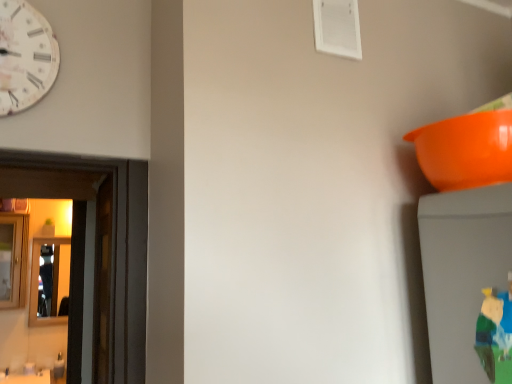
In order to face plush green toy at lower right, should I rotate leftwards or rightwards?

A 32.552 degree turn to the right will do.

The height and width of the screenshot is (384, 512). What are the coordinates of `plush green toy at lower right` in the screenshot? It's located at (496, 334).

I want to click on orange plastic bowl at upper right, so click(466, 150).

You are a GUI agent. You are given a task and a screenshot of the screen. Output one action in this format:
    pyautogui.click(x=<x>, y=<y>)
    Task: Click on the shiny silver mirror at left, which appears as the 2th mirror when viewed from the front
    This screenshot has height=384, width=512.
    Given the screenshot: What is the action you would take?
    pyautogui.click(x=38, y=282)

The width and height of the screenshot is (512, 384). In order to click on wooden mirror at left, which is the first mirror from front to back in this screenshot , I will do [x=13, y=260].

Locate an element on the screen. white paper-like clock at upper left is located at coordinates click(25, 56).

Would you say plush green toy at lower right is a long distance from shiny silver mirror at left, which appears as the 2th mirror when viewed from the front?

Yes, plush green toy at lower right is far from shiny silver mirror at left, which appears as the 2th mirror when viewed from the front.

Which is correct: plush green toy at lower right is inside shiny silver mirror at left, the first mirror positioned from the back, or outside of it?

plush green toy at lower right cannot be found inside shiny silver mirror at left, the first mirror positioned from the back.

Is plush green toy at lower right positioned with its back to shiny silver mirror at left, which appears as the 2th mirror when viewed from the front?

No, plush green toy at lower right is not facing away from shiny silver mirror at left, which appears as the 2th mirror when viewed from the front.

Considering the relative sizes of plush green toy at lower right and shiny silver mirror at left, the first mirror positioned from the back, in the image provided, is plush green toy at lower right wider than shiny silver mirror at left, the first mirror positioned from the back,?

No.

From the image's perspective, would you say orange plastic bowl at upper right is shown under plush green toy at lower right?

Actually, orange plastic bowl at upper right appears above plush green toy at lower right in the image.

Is point (479, 174) more distant than point (503, 317)?

Yes, it is behind point (503, 317).

Who is taller, orange plastic bowl at upper right or plush green toy at lower right?

With more height is plush green toy at lower right.

Would you say orange plastic bowl at upper right is outside plush green toy at lower right?

Yes, orange plastic bowl at upper right is not within plush green toy at lower right.

Is wooden mirror at left, the 2th mirror viewed from the back, turned away from plush green toy at lower right?

No.

Can you confirm if wooden mirror at left, which is the first mirror from front to back, is positioned to the left of plush green toy at lower right?

Yes.

Is wooden mirror at left, the 2th mirror viewed from the back, smaller than plush green toy at lower right?

Incorrect, wooden mirror at left, the 2th mirror viewed from the back, is not smaller in size than plush green toy at lower right.

Considering the sizes of wooden mirror at left, which is the first mirror from front to back, and plush green toy at lower right in the image, is wooden mirror at left, which is the first mirror from front to back, wider or thinner than plush green toy at lower right?

In the image, wooden mirror at left, which is the first mirror from front to back, appears to be wider than plush green toy at lower right.

Is wooden mirror at left, which is the first mirror from front to back, located within white paper-like clock at upper left?

That's incorrect, wooden mirror at left, which is the first mirror from front to back, is not inside white paper-like clock at upper left.

Is white paper-like clock at upper left looking in the opposite direction of wooden mirror at left, the 2th mirror viewed from the back?

That's right, white paper-like clock at upper left is facing away from wooden mirror at left, the 2th mirror viewed from the back.

Which of these two, white paper-like clock at upper left or wooden mirror at left, which is the first mirror from front to back, is wider?

With larger width is wooden mirror at left, which is the first mirror from front to back.

Based on the photo, which point is more distant from viewer, (12,282) or (429,164)?

The point (12,282) is behind.

From the picture: Measure the distance from wooden mirror at left, which is the first mirror from front to back, to orange plastic bowl at upper right.

wooden mirror at left, which is the first mirror from front to back, is 10.53 feet away from orange plastic bowl at upper right.

Considering the relative sizes of wooden mirror at left, which is the first mirror from front to back, and orange plastic bowl at upper right in the image provided, is wooden mirror at left, which is the first mirror from front to back, taller than orange plastic bowl at upper right?

Yes, wooden mirror at left, which is the first mirror from front to back, is taller than orange plastic bowl at upper right.

Is wooden mirror at left, which is the first mirror from front to back, located outside orange plastic bowl at upper right?

Yes, wooden mirror at left, which is the first mirror from front to back, is not within orange plastic bowl at upper right.

In the image, there is a orange plastic bowl at upper right. Identify the location of wall clock above it (from the image's perspective). The height and width of the screenshot is (384, 512). (25, 56).

Consider the image. From a real-world perspective, which object rests below the other?

orange plastic bowl at upper right, from a real-world perspective.

Who is bigger, white paper-like clock at upper left or orange plastic bowl at upper right?

With larger size is orange plastic bowl at upper right.

Is white paper-like clock at upper left looking in the opposite direction of orange plastic bowl at upper right?

No, white paper-like clock at upper left is not facing the opposite direction of orange plastic bowl at upper right.

Considering the relative positions of white paper-like clock at upper left and shiny silver mirror at left, the first mirror positioned from the back, in the image provided, is white paper-like clock at upper left behind shiny silver mirror at left, the first mirror positioned from the back,?

No, it is in front of shiny silver mirror at left, the first mirror positioned from the back.

From the image's perspective, which is below, white paper-like clock at upper left or shiny silver mirror at left, which appears as the 2th mirror when viewed from the front?

shiny silver mirror at left, which appears as the 2th mirror when viewed from the front, appears lower in the image.

Between white paper-like clock at upper left and shiny silver mirror at left, the first mirror positioned from the back, which one has larger width?

shiny silver mirror at left, the first mirror positioned from the back.

Between white paper-like clock at upper left and shiny silver mirror at left, which appears as the 2th mirror when viewed from the front, which one appears on the left side from the viewer's perspective?

From the viewer's perspective, shiny silver mirror at left, which appears as the 2th mirror when viewed from the front, appears more on the left side.

I want to click on toy in front of the shiny silver mirror at left, which appears as the 2th mirror when viewed from the front, so click(496, 334).

In the image, there is a orange plastic bowl at upper right. Where is `toy below it (from a real-world perspective)`? This screenshot has height=384, width=512. toy below it (from a real-world perspective) is located at coordinates (496, 334).

When comparing their distances from plush green toy at lower right, does orange plastic bowl at upper right or wooden mirror at left, which is the first mirror from front to back, seem closer?

orange plastic bowl at upper right.

Looking at the image, which one is located further to shiny silver mirror at left, which appears as the 2th mirror when viewed from the front, plush green toy at lower right or orange plastic bowl at upper right?

plush green toy at lower right is further to shiny silver mirror at left, which appears as the 2th mirror when viewed from the front.

Which object lies nearer to the anchor point wooden mirror at left, which is the first mirror from front to back, plush green toy at lower right or shiny silver mirror at left, the first mirror positioned from the back?

shiny silver mirror at left, the first mirror positioned from the back.

Looking at the image, which one is located further to wooden mirror at left, which is the first mirror from front to back, white paper-like clock at upper left or orange plastic bowl at upper right?

Among the two, orange plastic bowl at upper right is located further to wooden mirror at left, which is the first mirror from front to back.

Based on their spatial positions, is white paper-like clock at upper left or wooden mirror at left, the 2th mirror viewed from the back, further from shiny silver mirror at left, which appears as the 2th mirror when viewed from the front?

white paper-like clock at upper left.

Considering their positions, is orange plastic bowl at upper right positioned closer to plush green toy at lower right than shiny silver mirror at left, which appears as the 2th mirror when viewed from the front?

Among the two, orange plastic bowl at upper right is located nearer to plush green toy at lower right.

Based on their spatial positions, is wooden mirror at left, the 2th mirror viewed from the back, or white paper-like clock at upper left further from orange plastic bowl at upper right?

Based on the image, wooden mirror at left, the 2th mirror viewed from the back, appears to be further to orange plastic bowl at upper right.

Which object lies nearer to the anchor point plush green toy at lower right, shiny silver mirror at left, the first mirror positioned from the back, or orange plastic bowl at upper right?

Based on the image, orange plastic bowl at upper right appears to be nearer to plush green toy at lower right.

You are a GUI agent. You are given a task and a screenshot of the screen. Output one action in this format:
    pyautogui.click(x=<x>, y=<y>)
    Task: Click on the wall clock between plush green toy at lower right and shiny silver mirror at left, which appears as the 2th mirror when viewed from the front, in the front-back direction
    
    Given the screenshot: What is the action you would take?
    pyautogui.click(x=25, y=56)

The image size is (512, 384). I want to click on toy situated between white paper-like clock at upper left and orange plastic bowl at upper right from left to right, so click(496, 334).

Where is `mirror located between orange plastic bowl at upper right and shiny silver mirror at left, which appears as the 2th mirror when viewed from the front, in the depth direction`? The width and height of the screenshot is (512, 384). mirror located between orange plastic bowl at upper right and shiny silver mirror at left, which appears as the 2th mirror when viewed from the front, in the depth direction is located at coordinates (13, 260).

The width and height of the screenshot is (512, 384). I want to click on wall clock located between orange plastic bowl at upper right and shiny silver mirror at left, the first mirror positioned from the back, in the depth direction, so click(25, 56).